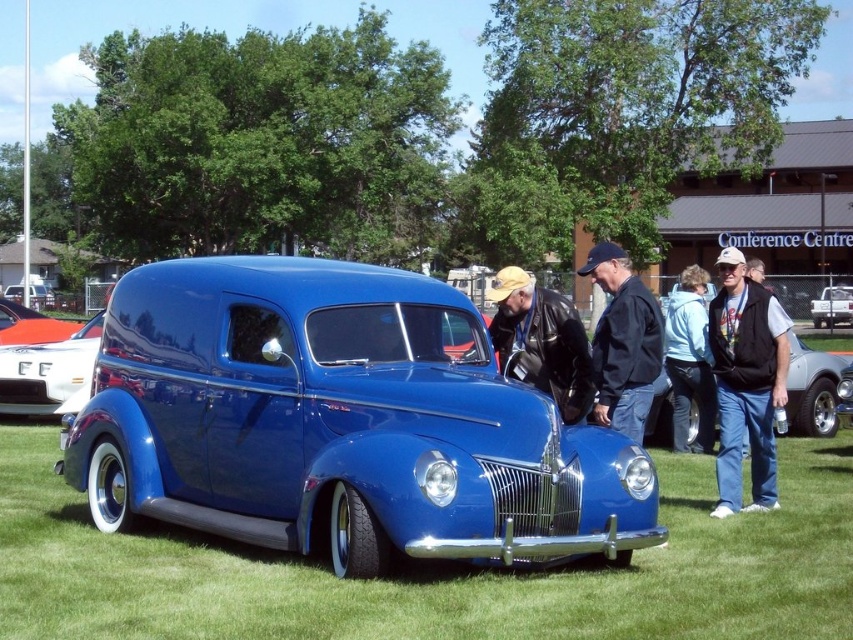
The width and height of the screenshot is (853, 640). What do you see at coordinates (339, 422) in the screenshot?
I see `shiny blue van at center` at bounding box center [339, 422].

Is point (618, 452) positioned before point (746, 474)?

Yes, point (618, 452) is in front of point (746, 474).

Image resolution: width=853 pixels, height=640 pixels. What are the coordinates of `shiny blue van at center` in the screenshot? It's located at pos(339,422).

Does leather jacket at center have a greater height compared to shiny white car at center?

No.

Looking at this image, who is higher up, leather jacket at center or shiny white car at center?

leather jacket at center

You are a GUI agent. You are given a task and a screenshot of the screen. Output one action in this format:
    pyautogui.click(x=<x>, y=<y>)
    Task: Click on the leather jacket at center
    
    Given the screenshot: What is the action you would take?
    pyautogui.click(x=541, y=340)

The image size is (853, 640). What are the coordinates of `black vest at right` in the screenshot? It's located at (746, 381).

Is black vest at right to the left of white glossy truck at center from the viewer's perspective?

Yes, black vest at right is to the left of white glossy truck at center.

Is point (763, 460) in front of point (851, 308)?

Yes, point (763, 460) is in front of point (851, 308).

This screenshot has height=640, width=853. In order to click on black vest at right in this screenshot , I will do `click(746, 381)`.